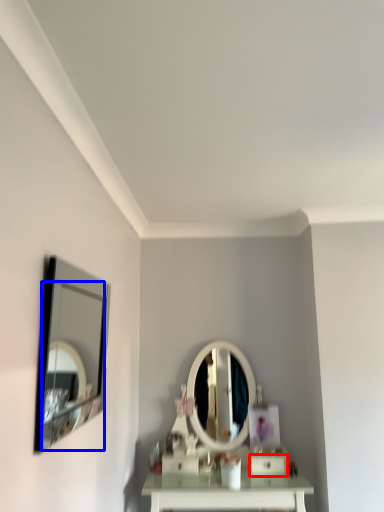
Question: Among these objects, which one is farthest to the camera, drawer (highlighted by a red box) or mirror (highlighted by a blue box)?

Choices:
 (A) drawer
 (B) mirror

Answer: (A)